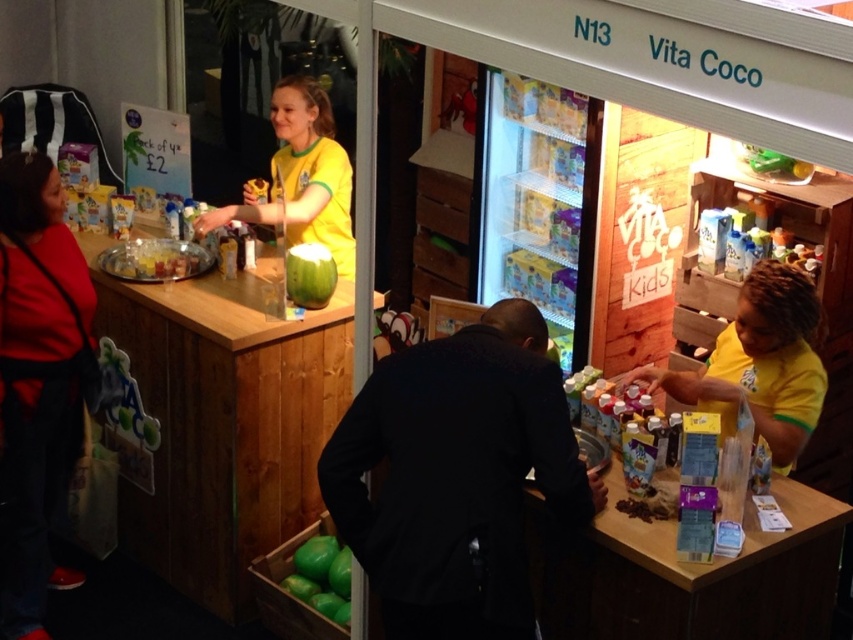
Is matte red jacket at left below yellow jersey at upper center?

Indeed, matte red jacket at left is positioned under yellow jersey at upper center.

Is point (47, 554) more distant than point (238, 220)?

No, (47, 554) is closer to viewer.

I want to click on matte red jacket at left, so click(x=38, y=376).

Which of these two, yellow matte shirt at right or yellow jersey at upper center, stands shorter?

With less height is yellow matte shirt at right.

From the picture: Who is more forward, (825, 380) or (329, 172)?

Point (825, 380)

Identify the location of yellow matte shirt at right. (759, 364).

Which of these two, yellow jersey at upper center or green matte coconut at center, stands taller?

Standing taller between the two is yellow jersey at upper center.

Is yellow jersey at upper center below green matte coconut at center?

No.

Where is `yellow jersey at upper center`? The image size is (853, 640). yellow jersey at upper center is located at coordinates (300, 177).

The height and width of the screenshot is (640, 853). Find the location of `yellow jersey at upper center`. yellow jersey at upper center is located at coordinates (300, 177).